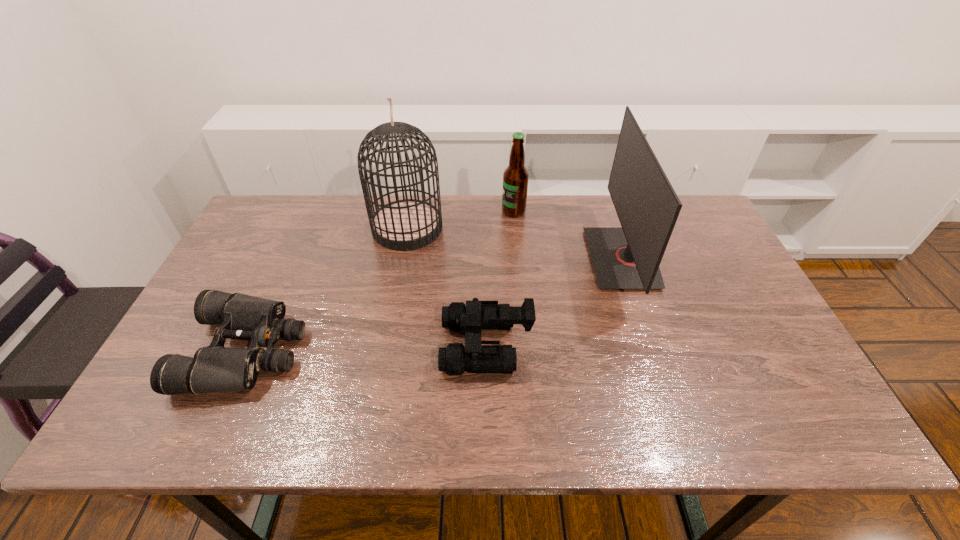
This screenshot has width=960, height=540. In order to click on monitor that is positioned at the far edge in this screenshot , I will do `click(628, 257)`.

This screenshot has width=960, height=540. What are the coordinates of `beer bottle present at the far edge` in the screenshot? It's located at (515, 177).

Where is `object that is at the near edge`? Image resolution: width=960 pixels, height=540 pixels. object that is at the near edge is located at coordinates 215,368.

I want to click on object located in the left edge section of the desktop, so click(215, 368).

At what (x,y) coordinates should I click in order to perform the action: click on object located at the near left corner. Please return your answer as a coordinate pair (x, y). The image size is (960, 540). Looking at the image, I should click on (215, 368).

The height and width of the screenshot is (540, 960). Identify the location of free space at the far edge. (443, 201).

Where is `vacant area at the near edge of the desktop`? vacant area at the near edge of the desktop is located at coordinates (716, 422).

Locate an element on the screen. free spot at the right edge of the desktop is located at coordinates (747, 395).

You are a GUI agent. You are given a task and a screenshot of the screen. Output one action in this format:
    pyautogui.click(x=<x>, y=<y>)
    Task: Click on the unoccupied area between the fourth object from right to left and the shortest object
    This screenshot has height=540, width=960.
    Given the screenshot: What is the action you would take?
    pyautogui.click(x=327, y=289)

I want to click on free area in between the birdcage and the third tallest object, so click(x=461, y=220).